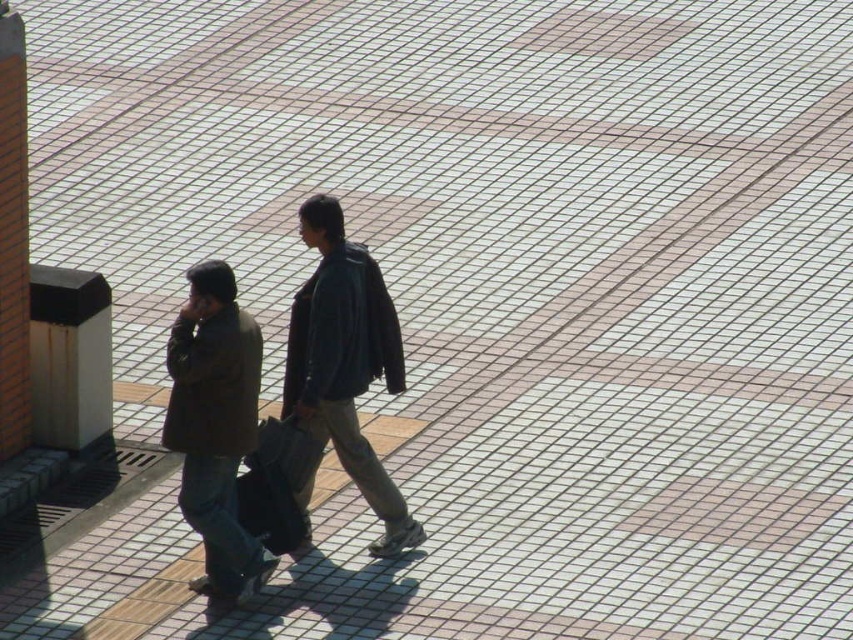
From the picture: You are a photographer standing at the edge of the plaza. You want to take a picture of both the dark brown leather jacket at center and the dark blue leather jacket at center. Can you fit both subjects in the frame if your camera has a minimum required distance of 0.75 inches between them for clarity?

Yes, the dark brown leather jacket at center and the dark blue leather jacket at center are 0.80 inches apart, which exceeds the camera requirement of 0.75 inches, so both can be captured clearly in the frame.

You are a photographer standing at the edge of the plaza. You want to take a photo of both the dark brown leather jacket at center and the brown matte jacket at center in the same frame. Considering the camera you have can capture a maximum width of 20 inches, will you be able to fit both jackets in the frame?

The distance between the dark brown leather jacket at center and the brown matte jacket at center is 21.13 inches. Since the camera can only capture a maximum width of 20 inches, the jackets are slightly too far apart to fit within the frame.

You are standing at the point closer to the camera in the plaza. Which point are you at, point (285, 380) or point (337, 310)?

You are at point (285, 380) because it is further to the camera than point (337, 310).